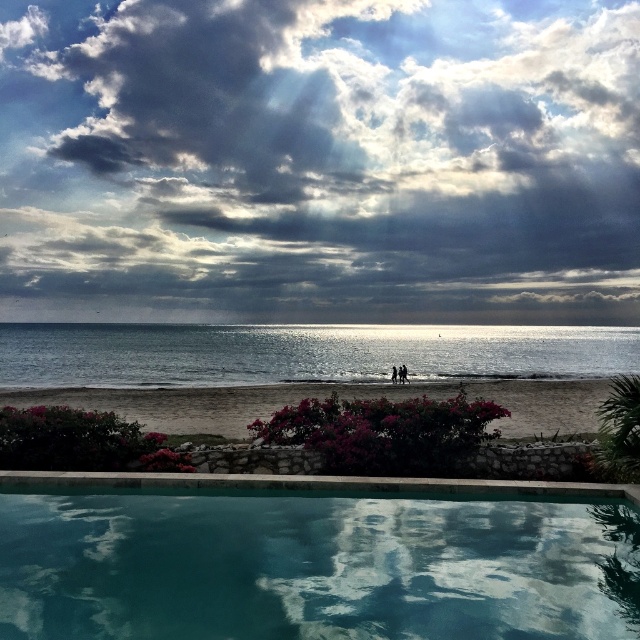
You are a lifeguard standing at the edge of the teal glass swimming pool at bottom. You notice a swimmer in the distance near the beige sand beach at lower center. Can you see the entire beach from your position at the pool?

The teal glass swimming pool at bottom is smaller than the beige sand beach at lower center, so the beach extends beyond the pool, making it possible to see the entire beach from the pool edge.

You are standing on the beige sand beach at lower center and want to reach the shiny silver water at center. Which direction should you move to get there?

You should move upward because the shiny silver water at center is above the beige sand beach at lower center.

You are standing at the edge of the scene and want to walk to the shiny silver water at center. Is the beige sand beach at lower center in your path?

Yes, the beige sand beach at lower center is behind the shiny silver water at center, so it is not in your path. To reach the shiny silver water at center, you would need to walk towards it, and the beige sand beach at lower center is located behind the water, meaning it is not blocking your path.